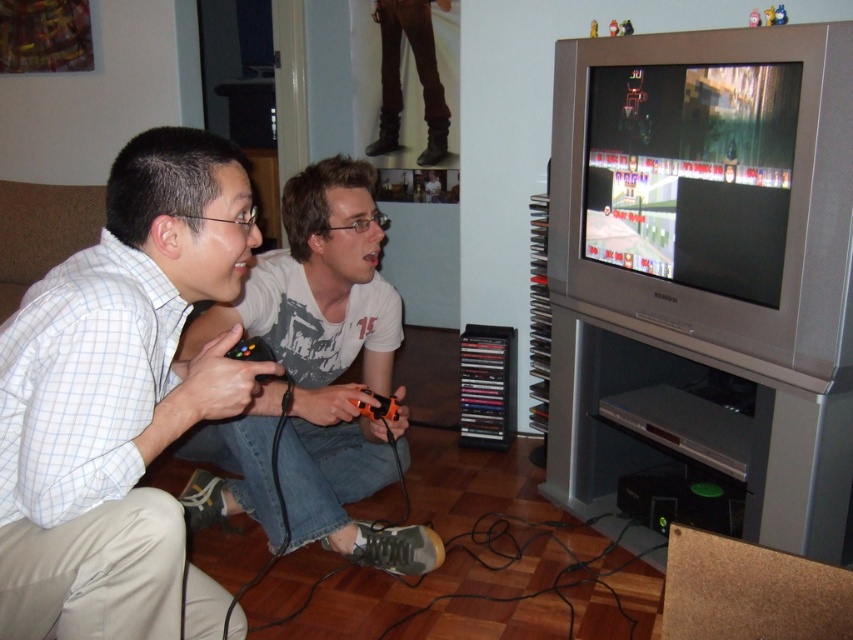
You are a delivery person who needs to place a 20 inch wide package between the light blue checkered shirt at lower left and the matte gray shirt at center. Can you fit the package between them without moving either shirt?

The distance between the light blue checkered shirt at lower left and the matte gray shirt at center is 22.21 inches, which is wider than the 20 inch package. Therefore, the package can be placed between them without moving either shirt.

You are a photographer trying to capture a candid shot of both the light blue checkered shirt at lower left and the matte gray shirt at center. Since you want to ensure both are fully visible in the frame, which person should you position closer to the camera to avoid cropping?

The light blue checkered shirt at lower left is not as tall as matte gray shirt at center, so you should position the light blue checkered shirt at lower left closer to the camera to ensure both are fully visible in the frame.